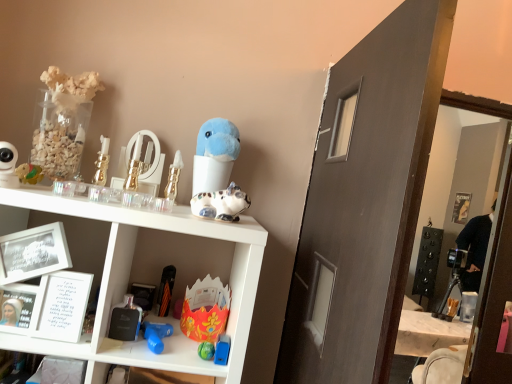
Question: Is shiny plastic toy at left, positioned as the 11th toy in right-to-left order, positioned with its back to floral paper crown at center, which is the 7th toy in left-to-right order?

Choices:
 (A) yes
 (B) no

Answer: (B)

Question: Is floral paper crown at center, which is the 7th toy in left-to-right order, completely or partially inside shiny plastic toy at left, acting as the first toy starting from the left?

Choices:
 (A) no
 (B) yes

Answer: (A)

Question: From the image's perspective, is shiny plastic toy at left, acting as the first toy starting from the left, on floral paper crown at center, which is the 7th toy in left-to-right order?

Choices:
 (A) yes
 (B) no

Answer: (A)

Question: From a real-world perspective, is shiny plastic toy at left, acting as the first toy starting from the left, under floral paper crown at center, which is the fifth toy in right-to-left order?

Choices:
 (A) no
 (B) yes

Answer: (A)

Question: Does shiny plastic toy at left, acting as the first toy starting from the left, turn towards floral paper crown at center, which is the 7th toy in left-to-right order?

Choices:
 (A) yes
 (B) no

Answer: (B)

Question: Considering the positions of point (209, 349) and point (15, 155), is point (209, 349) closer or farther from the camera than point (15, 155)?

Choices:
 (A) closer
 (B) farther

Answer: (B)

Question: From a real-world perspective, relative to matte white camera at left, the second toy from the left, is shiny green ball at lower center, marked as the ninth toy in a left-to-right arrangement, vertically above or below?

Choices:
 (A) above
 (B) below

Answer: (B)

Question: Based on their sizes in the image, would you say shiny green ball at lower center, which is counted as the 3th toy, starting from the right, is bigger or smaller than matte white camera at left, the second toy from the left?

Choices:
 (A) small
 (B) big

Answer: (A)

Question: In the image, is shiny green ball at lower center, marked as the ninth toy in a left-to-right arrangement, on the left side or the right side of matte white camera at left, the second toy from the left?

Choices:
 (A) right
 (B) left

Answer: (A)

Question: Based on their sizes in the image, would you say blue plastic toy at lower center, the first toy when ordered from right to left, is bigger or smaller than matte black shelf at lower left?

Choices:
 (A) big
 (B) small

Answer: (B)

Question: Considering the positions of point (223, 336) and point (16, 380), is point (223, 336) closer or farther from the camera than point (16, 380)?

Choices:
 (A) farther
 (B) closer

Answer: (A)

Question: From a real-world perspective, is blue plastic toy at lower center, the first toy when ordered from right to left, physically located above or below matte black shelf at lower left?

Choices:
 (A) below
 (B) above

Answer: (B)

Question: Is blue plastic toy at lower center, the first toy when ordered from right to left, spatially inside matte black shelf at lower left, or outside of it?

Choices:
 (A) inside
 (B) outside

Answer: (B)

Question: From the image's perspective, is white matte picture frame at left positioned above or below orange matte umbrella at lower center, positioned as the 8th toy in right-to-left order?

Choices:
 (A) below
 (B) above

Answer: (B)

Question: From a real-world perspective, is white matte picture frame at left physically located above or below orange matte umbrella at lower center, placed as the fourth toy when sorted from left to right?

Choices:
 (A) above
 (B) below

Answer: (A)